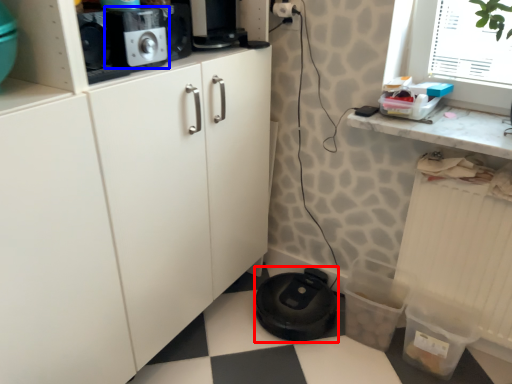
Question: Among these objects, which one is nearest to the camera, appliance (highlighted by a red box) or home appliance (highlighted by a blue box)?

Choices:
 (A) appliance
 (B) home appliance

Answer: (B)